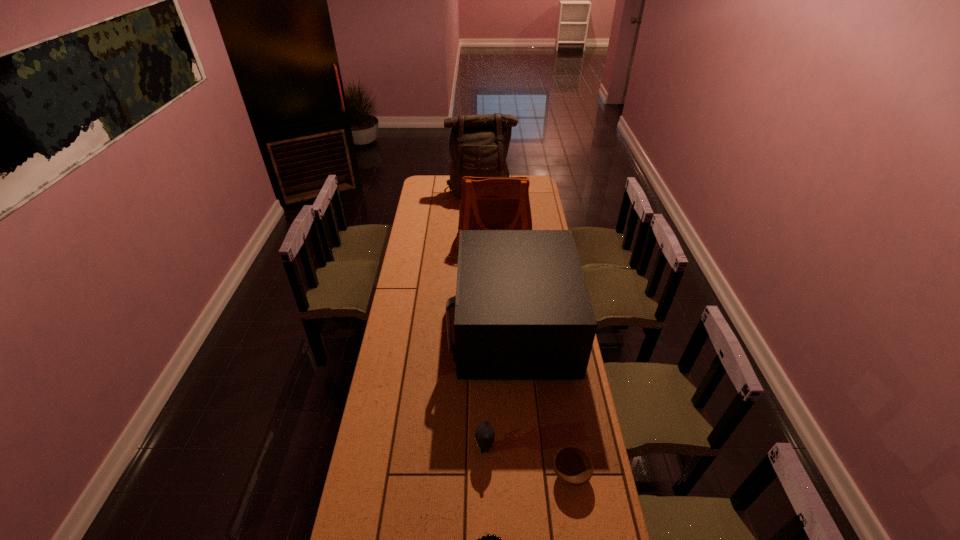
Locate an element on the screen. The height and width of the screenshot is (540, 960). free point located 0.070m on the front-facing side of the fourth shortest object is located at coordinates (435, 328).

Identify the location of vacant space located on the front-facing side of the fourth shortest object. The image size is (960, 540). tap(403, 328).

This screenshot has height=540, width=960. Identify the location of free space located 0.180m on the front-facing side of the fourth shortest object. (410, 328).

Identify the location of free spot located on the front-facing side of the fourth tallest object. The width and height of the screenshot is (960, 540). (402, 448).

The image size is (960, 540). I want to click on free space located on the front-facing side of the fourth tallest object, so click(420, 448).

What are the coordinates of `free space located 0.080m on the front-facing side of the fourth tallest object` in the screenshot? It's located at (451, 448).

Identify the location of vacant space situated on the left of the second shortest object. Image resolution: width=960 pixels, height=540 pixels. (494, 475).

What are the coordinates of `object at the far edge` in the screenshot? It's located at (478, 146).

Locate an element on the screen. The height and width of the screenshot is (540, 960). shopping bag located at the right edge is located at coordinates (487, 203).

Where is `microwave oven at the right edge`? This screenshot has width=960, height=540. microwave oven at the right edge is located at coordinates (522, 309).